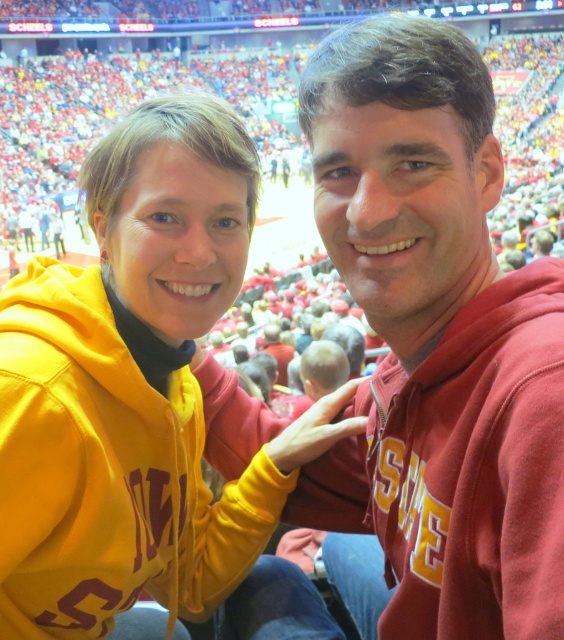
You are sitting in the stands at a basketball game and see two hoodies in front of you. The matte yellow hoodie at center and the matte red hoodie at center. Which one is closer to you?

The matte yellow hoodie at center is closer to you because it is located below the matte red hoodie at center, indicating it is positioned in a lower row of seating.

You are trying to decide which hoodie is shorter between the matte yellow hoodie at center and the matte red hoodie at center. Based on their positions in the image, which one do you think is shorter?

The matte yellow hoodie at center is not as tall as the matte red hoodie at center, so the matte yellow hoodie at center is shorter.

You are taking a photo of the matte yellow hoodie at center. What coordinates should you aim for?

You should aim for point (143,404) to capture the matte yellow hoodie at center.